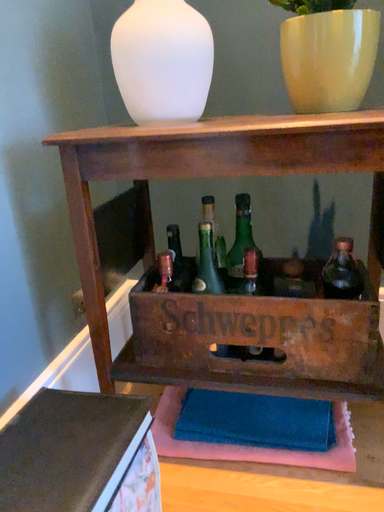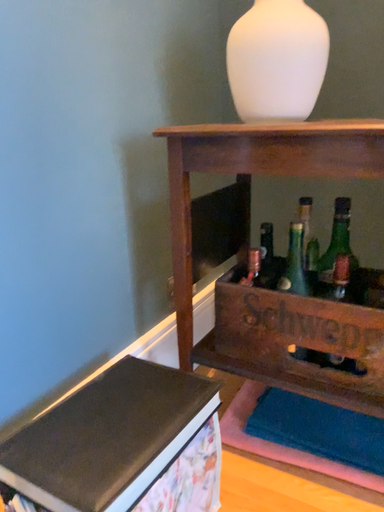
Question: Which way did the camera rotate in the video?

Choices:
 (A) rotated right
 (B) rotated left

Answer: (B)